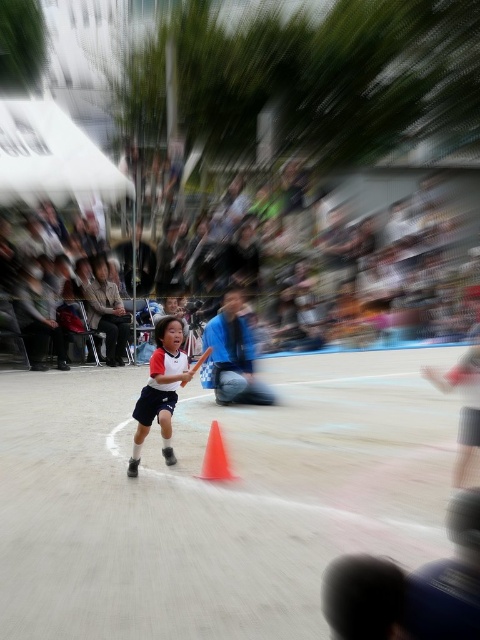
Question: Considering the real-world distances, which object is closest to the light brown fabric chair at center?

Choices:
 (A) wooden baseball bat at center
 (B) smooth asphalt track at center
 (C) blue fabric at center
 (D) orange plastic traffic cone at center

Answer: (C)

Question: Which of the following is the closest to the observer?

Choices:
 (A) (193, 364)
 (B) (22, 332)
 (C) (183, 547)
 (D) (132, 467)

Answer: (C)

Question: Which object is the closest to the orange plastic traffic cone at center?

Choices:
 (A) blue fabric at center
 (B) light brown fabric chair at center
 (C) dark brown leather jacket at upper left
 (D) smooth asphalt track at center

Answer: (D)

Question: Is blue fabric at center positioned at the back of light brown fabric chair at center?

Choices:
 (A) no
 (B) yes

Answer: (A)

Question: Does light brown fabric chair at center have a lesser width compared to orange plastic traffic cone at center?

Choices:
 (A) yes
 (B) no

Answer: (B)

Question: Is smooth asphalt track at center bigger than light brown fabric chair at center?

Choices:
 (A) yes
 (B) no

Answer: (B)